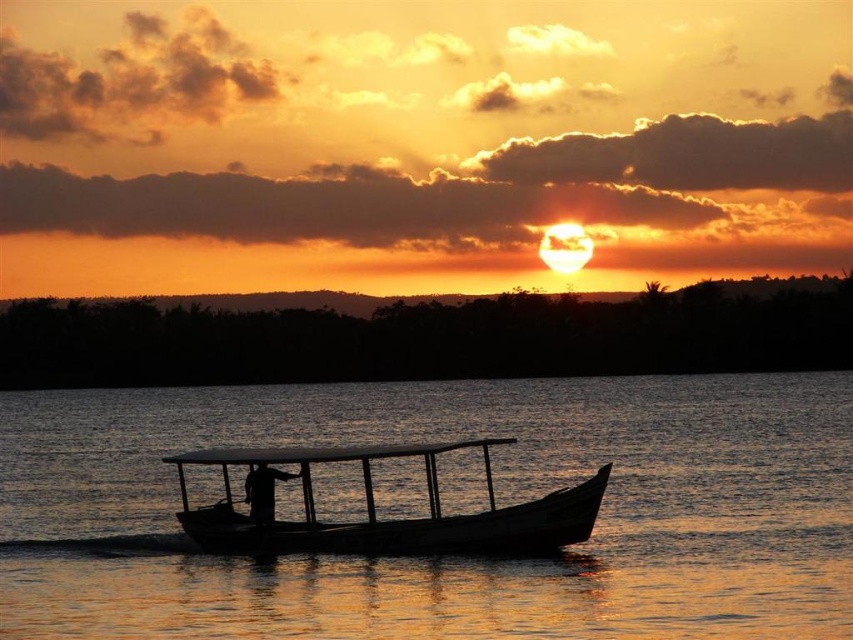
You are an observer standing on the shore looking at the wooden boat at center and the transparent water at boat center. Which object is closer to you?

The transparent water at boat center is closer to you because it is in front of the wooden boat at center.

You are an observer standing on the lakeshore. You see the transparent water at boat center and the wooden boat at center. Which object takes up more space in the image?

The transparent water at boat center has a larger size compared to the wooden boat at center, so it takes up more space in the image.

You are standing on the shore observing the sunset scene. Which object, the transparent water at boat center or the wooden boat at center, is positioned to the left?

The transparent water at boat center is positioned to the left of the wooden boat at center.